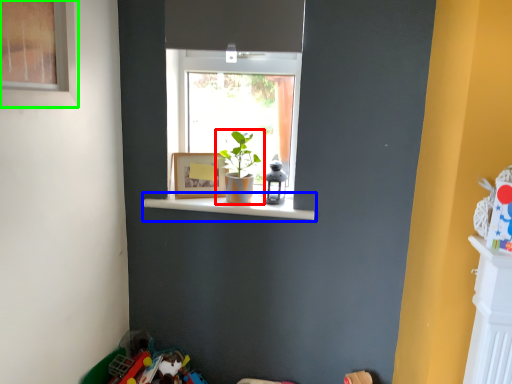
Question: Which is farther away from houseplant (highlighted by a red box)? window sill (highlighted by a blue box) or window (highlighted by a green box)?

Choices:
 (A) window sill
 (B) window

Answer: (B)